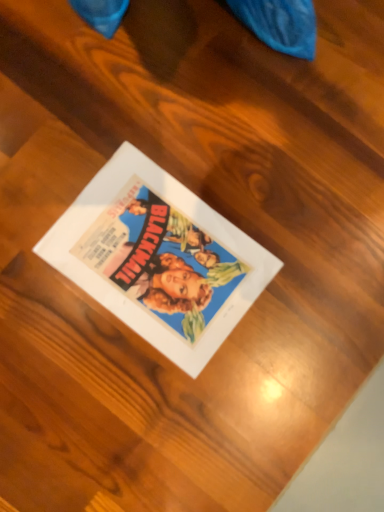
What are the coordinates of `free spot in front of matte paper poster at center` in the screenshot? It's located at (119, 408).